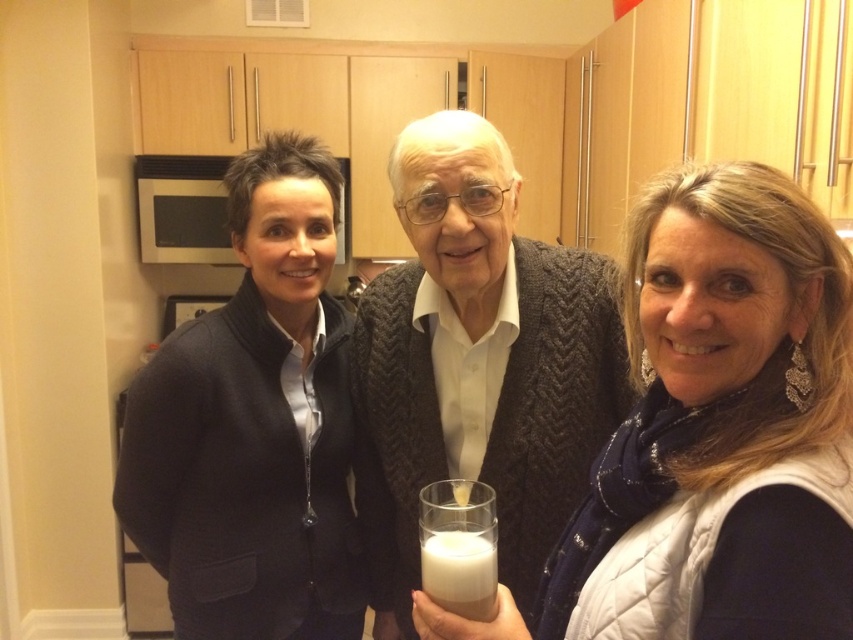
Does white matte glass at center have a greater width compared to stainless steel microwave at left?

Yes.

Who is positioned more to the left, white matte glass at center or stainless steel microwave at left?

Positioned to the left is stainless steel microwave at left.

Is point (625, 305) closer to camera compared to point (181, 205)?

Yes, it is in front of point (181, 205).

Locate an element on the screen. white matte glass at center is located at coordinates (486, 358).

Is white matte glass at center in front of dark blue sweater at center?

Yes.

Is point (691, 193) closer to viewer compared to point (160, 449)?

Yes, point (691, 193) is in front of point (160, 449).

Between point (585, 438) and point (332, 358), which one is positioned behind?

The point (332, 358) is more distant.

You are a GUI agent. You are given a task and a screenshot of the screen. Output one action in this format:
    pyautogui.click(x=<x>, y=<y>)
    Task: Click on the white matte glass at center
    The height and width of the screenshot is (640, 853).
    Given the screenshot: What is the action you would take?
    pyautogui.click(x=486, y=358)

Does white matte glass at center appear under white frothy liquid at center?

No, white matte glass at center is not below white frothy liquid at center.

Which is in front, point (439, 228) or point (440, 490)?

Point (440, 490)

The height and width of the screenshot is (640, 853). In order to click on white matte glass at center in this screenshot , I will do `click(486, 358)`.